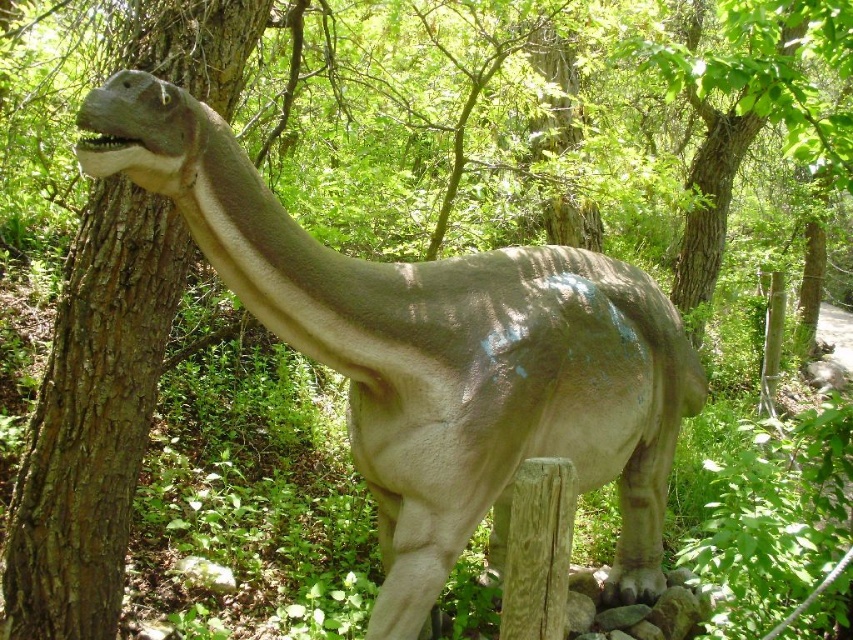
Question: Does brown rough tree trunk at left have a larger size compared to green leafy tree at upper center?

Choices:
 (A) yes
 (B) no

Answer: (B)

Question: Is brown rough tree trunk at left closer to the viewer compared to green leafy tree at upper center?

Choices:
 (A) no
 (B) yes

Answer: (A)

Question: Considering the real-world distances, which object is closest to the smooth gray dinosaur at center?

Choices:
 (A) green leafy tree at upper center
 (B) brown rough tree trunk at left

Answer: (B)

Question: Which point is farther to the camera?

Choices:
 (A) (68, 524)
 (B) (747, 81)
 (C) (355, 420)

Answer: (C)

Question: Which of the following is the closest to the observer?

Choices:
 (A) brown rough tree trunk at left
 (B) green leafy tree at upper center
 (C) smooth gray dinosaur at center

Answer: (C)

Question: Does smooth gray dinosaur at center have a smaller size compared to green leafy tree at upper center?

Choices:
 (A) yes
 (B) no

Answer: (A)